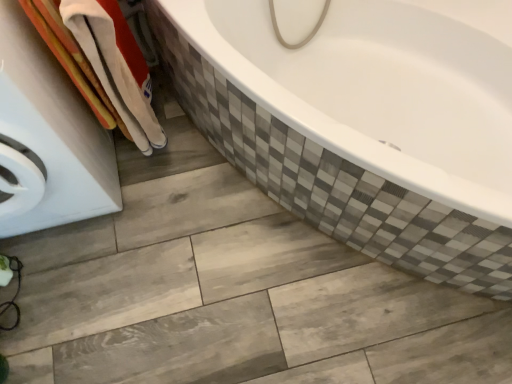
What do you see at coordinates (113, 69) in the screenshot? I see `white cotton towel at left` at bounding box center [113, 69].

Where is `white cotton towel at left`? The height and width of the screenshot is (384, 512). white cotton towel at left is located at coordinates (113, 69).

What do you see at coordinates (47, 138) in the screenshot? The width and height of the screenshot is (512, 384). I see `white glossy washing machine at left` at bounding box center [47, 138].

Where is `white glossy washing machine at left`? This screenshot has height=384, width=512. white glossy washing machine at left is located at coordinates (47, 138).

What is the approximate width of white glossy washing machine at left?

white glossy washing machine at left is 24.25 inches in width.

The image size is (512, 384). In order to click on white cotton towel at left in this screenshot , I will do `click(113, 69)`.

Considering the relative positions of white cotton towel at left and white glossy washing machine at left in the image provided, is white cotton towel at left to the right of white glossy washing machine at left from the viewer's perspective?

Indeed, white cotton towel at left is positioned on the right side of white glossy washing machine at left.

Which object is closer to the camera taking this photo, white cotton towel at left or white glossy washing machine at left?

white glossy washing machine at left.

Which point is more distant from viewer, (136, 130) or (13, 17)?

Point (136, 130)

From the image's perspective, which object appears higher, white cotton towel at left or white glossy washing machine at left?

white cotton towel at left, from the image's perspective.

From a real-world perspective, is white cotton towel at left physically below white glossy washing machine at left?

No.

Can you confirm if white cotton towel at left is wider than white glossy washing machine at left?

No, white cotton towel at left is not wider than white glossy washing machine at left.

Who is taller, white cotton towel at left or white glossy washing machine at left?

With more height is white glossy washing machine at left.

Considering the relative sizes of white cotton towel at left and white glossy washing machine at left in the image provided, is white cotton towel at left bigger than white glossy washing machine at left?

Incorrect, white cotton towel at left is not larger than white glossy washing machine at left.

Would you say white cotton towel at left is inside or outside white glossy washing machine at left?

white cotton towel at left is outside white glossy washing machine at left.

Is white cotton towel at left next to white glossy washing machine at left?

No, white cotton towel at left is not in contact with white glossy washing machine at left.

Is white cotton towel at left positioned with its back to white glossy washing machine at left?

Yes.

How many degrees apart are the facing directions of white cotton towel at left and white glossy washing machine at left?

90.9 degrees separate the facing orientations of white cotton towel at left and white glossy washing machine at left.

How far apart are white cotton towel at left and white glossy washing machine at left?

white cotton towel at left is 7.61 inches away from white glossy washing machine at left.

Locate an element on the screen. This screenshot has height=384, width=512. bath towel that is behind the white glossy washing machine at left is located at coordinates (113, 69).

Which object is positioned more to the left, white glossy washing machine at left or white cotton towel at left?

white glossy washing machine at left.

Who is more distant, white glossy washing machine at left or white cotton towel at left?

white cotton towel at left is behind.

Which is more distant, (11, 79) or (97, 32)?

The point (97, 32) is farther.

From the image's perspective, does white glossy washing machine at left appear higher than white cotton towel at left?

No, from the image's perspective, white glossy washing machine at left is not on top of white cotton towel at left.

Consider the image. From a real-world perspective, which object rests below the other?

In real-world perspective, white glossy washing machine at left is lower.

Does white glossy washing machine at left have a greater width compared to white cotton towel at left?

Correct, the width of white glossy washing machine at left exceeds that of white cotton towel at left.

From the picture: Is white glossy washing machine at left taller than white cotton towel at left?

Yes.

Considering the sizes of white glossy washing machine at left and white cotton towel at left in the image, is white glossy washing machine at left bigger or smaller than white cotton towel at left?

In the image, white glossy washing machine at left appears to be larger than white cotton towel at left.

Would you say white glossy washing machine at left is outside white cotton towel at left?

Absolutely, white glossy washing machine at left is external to white cotton towel at left.

Is white glossy washing machine at left next to white cotton towel at left?

They are not placed beside each other.

Is white glossy washing machine at left facing away from white cotton towel at left?

No, white cotton towel at left is not at the back of white glossy washing machine at left.

How different are the orientations of white glossy washing machine at left and white cotton towel at left in degrees?

The angle between the facing direction of white glossy washing machine at left and the facing direction of white cotton towel at left is 90.9 degrees.

Locate an element on the screen. The image size is (512, 384). bath towel on the right of white glossy washing machine at left is located at coordinates (113, 69).

Where is `bath towel on the right of white glossy washing machine at left`? Image resolution: width=512 pixels, height=384 pixels. bath towel on the right of white glossy washing machine at left is located at coordinates (113, 69).

Identify the location of bath towel that is above the white glossy washing machine at left (from a real-world perspective). (113, 69).